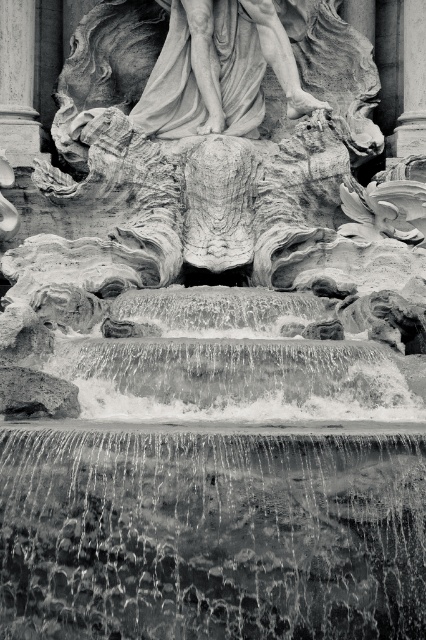
Consider the image. Can you confirm if translucent water at center is bigger than smooth stone pillar at left?

Yes, translucent water at center is bigger than smooth stone pillar at left.

In the scene shown: Who is more forward, (379, 612) or (5, 67)?

Point (379, 612)

Locate an element on the screen. The image size is (426, 640). translucent water at center is located at coordinates 212,536.

Can you confirm if translucent water at center is positioned to the left of smooth stone pillar at upper right?

Yes, translucent water at center is to the left of smooth stone pillar at upper right.

Based on the photo, does translucent water at center have a smaller size compared to smooth stone pillar at upper right?

No, translucent water at center is not smaller than smooth stone pillar at upper right.

Find the location of a particular element. The image size is (426, 640). translucent water at center is located at coordinates (212, 536).

The width and height of the screenshot is (426, 640). I want to click on translucent water at center, so click(x=212, y=536).

Does smooth stone pillar at left have a greater width compared to smooth stone pillar at upper right?

Yes, smooth stone pillar at left is wider than smooth stone pillar at upper right.

Does smooth stone pillar at left have a larger size compared to smooth stone pillar at upper right?

Indeed, smooth stone pillar at left has a larger size compared to smooth stone pillar at upper right.

Is point (17, 109) farther from camera compared to point (425, 81)?

No, (17, 109) is in front of (425, 81).

Where is `smooth stone pillar at left`? The image size is (426, 640). smooth stone pillar at left is located at coordinates (17, 83).